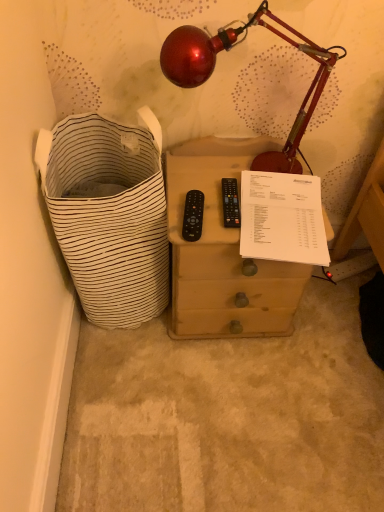
Question: Based on their positions, is white paper at upper right located to the left or right of black plastic remote at center, the second control when ordered from left to right?

Choices:
 (A) right
 (B) left

Answer: (A)

Question: In the image, is white paper at upper right positioned in front of or behind black plastic remote at center, the second control when ordered from left to right?

Choices:
 (A) front
 (B) behind

Answer: (A)

Question: Which of these objects is positioned farthest from the black plastic remote at center, the 1th control viewed from the left?

Choices:
 (A) metallic red lamp at upper center
 (B) black plastic remote at center, the second control when ordered from left to right
 (C) white striped fabric laundry basket at left
 (D) white paper at upper right
 (E) wooden nightstand at center

Answer: (A)

Question: Estimate the real-world distances between objects in this image. Which object is farther from the black plastic remote at center, the second control when ordered from left to right?

Choices:
 (A) white paper at upper right
 (B) metallic red lamp at upper center
 (C) white striped fabric laundry basket at left
 (D) wooden nightstand at center
 (E) black plastic remote at center, the 1th control viewed from the left

Answer: (C)